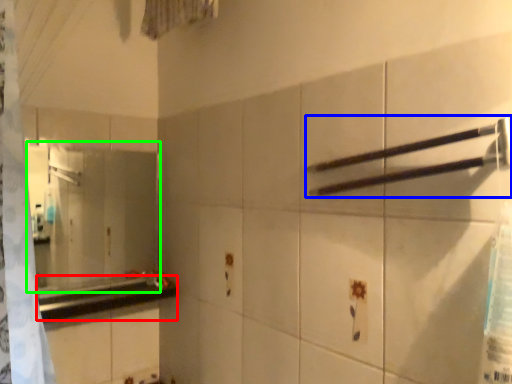
Question: Which is farther away from counter top (highlighted by a red box)? towel bar (highlighted by a blue box) or mirror (highlighted by a green box)?

Choices:
 (A) towel bar
 (B) mirror

Answer: (A)